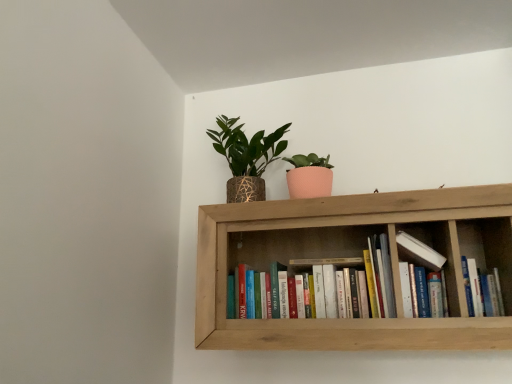
Question: Does hardcover books at center, which appears as the 1th book when viewed from the left, have a lesser height compared to hardcover book at center, positioned as the 2th book in left-to-right order?

Choices:
 (A) no
 (B) yes

Answer: (A)

Question: From the image's perspective, is hardcover books at center, which appears as the 1th book when viewed from the left, under hardcover book at center, positioned as the 2th book in left-to-right order?

Choices:
 (A) yes
 (B) no

Answer: (B)

Question: Is hardcover books at center, which appears as the 1th book when viewed from the left, wider than hardcover book at center, which is the 1th book in right-to-left order?

Choices:
 (A) no
 (B) yes

Answer: (B)

Question: Does hardcover books at center, the second book from the right, have a greater height compared to hardcover book at center, which is the 1th book in right-to-left order?

Choices:
 (A) no
 (B) yes

Answer: (B)

Question: From a real-world perspective, is hardcover books at center, the second book from the right, positioned under hardcover book at center, which is the 1th book in right-to-left order, based on gravity?

Choices:
 (A) yes
 (B) no

Answer: (B)

Question: From their relative heights in the image, would you say hardcover book at center, which is the 1th book in right-to-left order, is taller or shorter than wooden bookshelf at upper center?

Choices:
 (A) short
 (B) tall

Answer: (A)

Question: Considering their positions, is hardcover book at center, positioned as the 2th book in left-to-right order, located in front of or behind wooden bookshelf at upper center?

Choices:
 (A) front
 (B) behind

Answer: (B)

Question: Do you think hardcover book at center, positioned as the 2th book in left-to-right order, is within wooden bookshelf at upper center, or outside of it?

Choices:
 (A) outside
 (B) inside

Answer: (B)

Question: Is hardcover book at center, positioned as the 2th book in left-to-right order, to the left or to the right of wooden bookshelf at upper center in the image?

Choices:
 (A) left
 (B) right

Answer: (B)

Question: Considering the positions of point (262, 200) and point (486, 296), is point (262, 200) closer or farther from the camera than point (486, 296)?

Choices:
 (A) closer
 (B) farther

Answer: (B)

Question: From a real-world perspective, is textured gold pot at upper center physically located above or below hardcover book at center, positioned as the 2th book in left-to-right order?

Choices:
 (A) above
 (B) below

Answer: (A)

Question: From their relative heights in the image, would you say textured gold pot at upper center is taller or shorter than hardcover book at center, which is the 1th book in right-to-left order?

Choices:
 (A) tall
 (B) short

Answer: (A)

Question: Considering the positions of textured gold pot at upper center and hardcover book at center, which is the 1th book in right-to-left order, in the image, is textured gold pot at upper center bigger or smaller than hardcover book at center, which is the 1th book in right-to-left order,?

Choices:
 (A) small
 (B) big

Answer: (B)

Question: Is textured gold pot at upper center inside the boundaries of wooden bookshelf at upper center, or outside?

Choices:
 (A) inside
 (B) outside

Answer: (B)

Question: Is point (251, 165) positioned closer to the camera than point (273, 256)?

Choices:
 (A) closer
 (B) farther

Answer: (A)